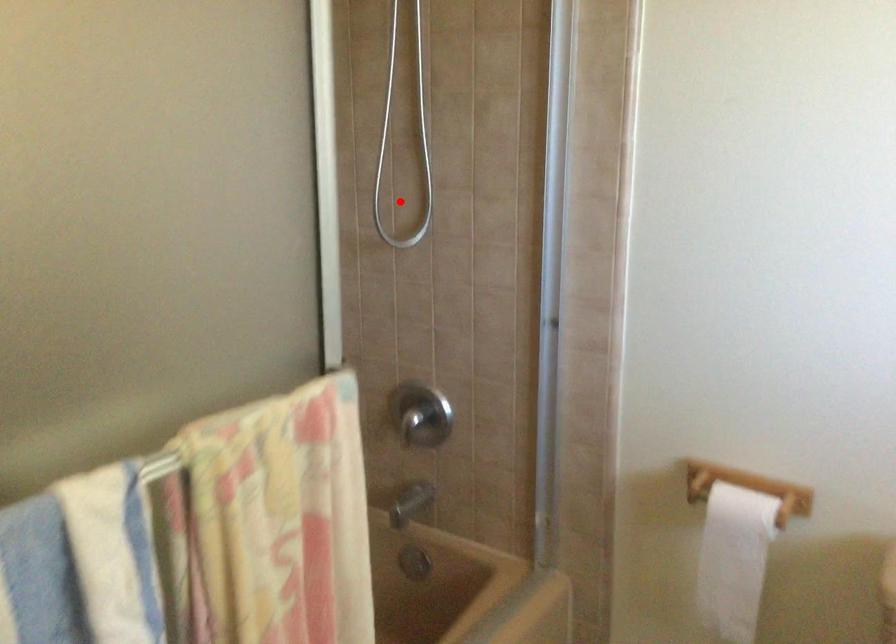
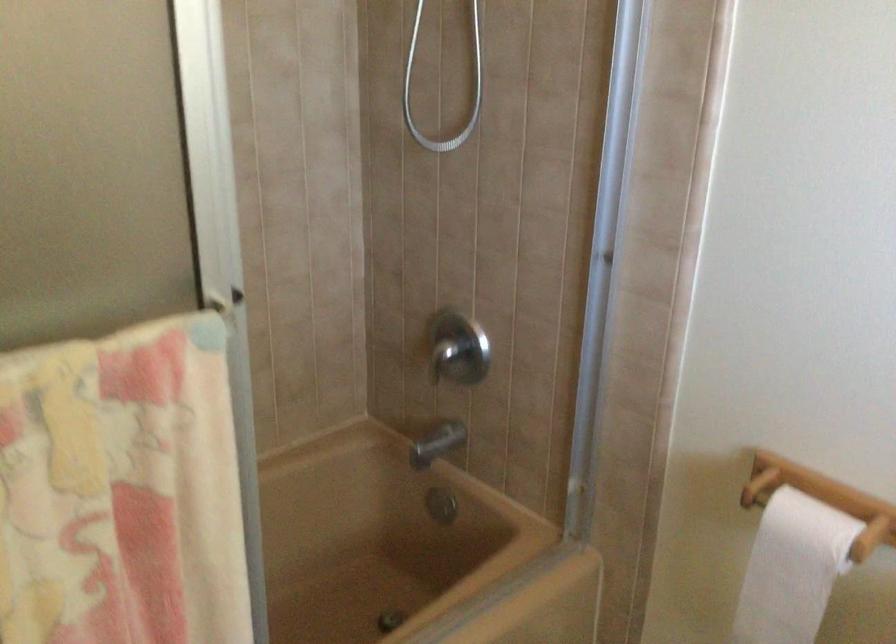
Where in the second image is the point corresponding to the highlighted location from the first image?

(444, 86)